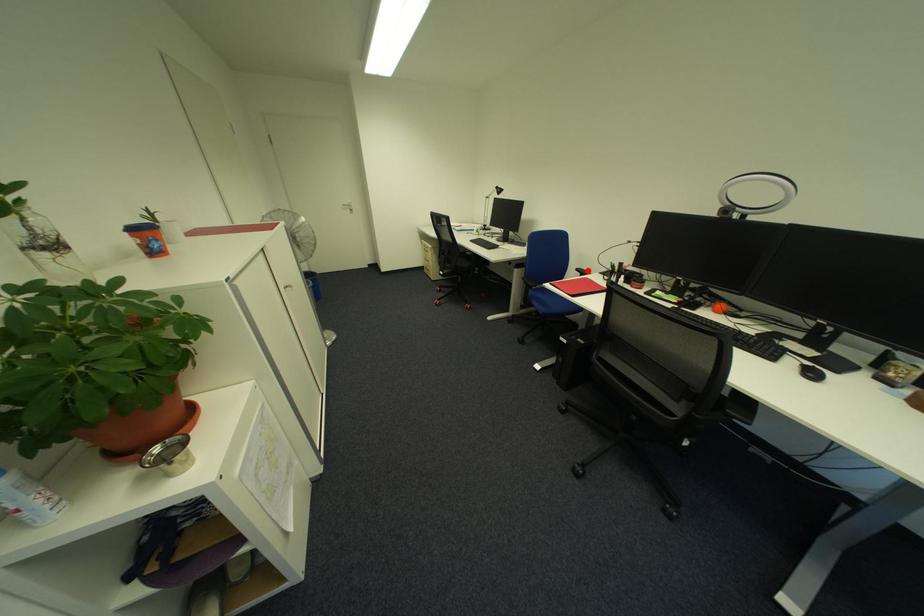
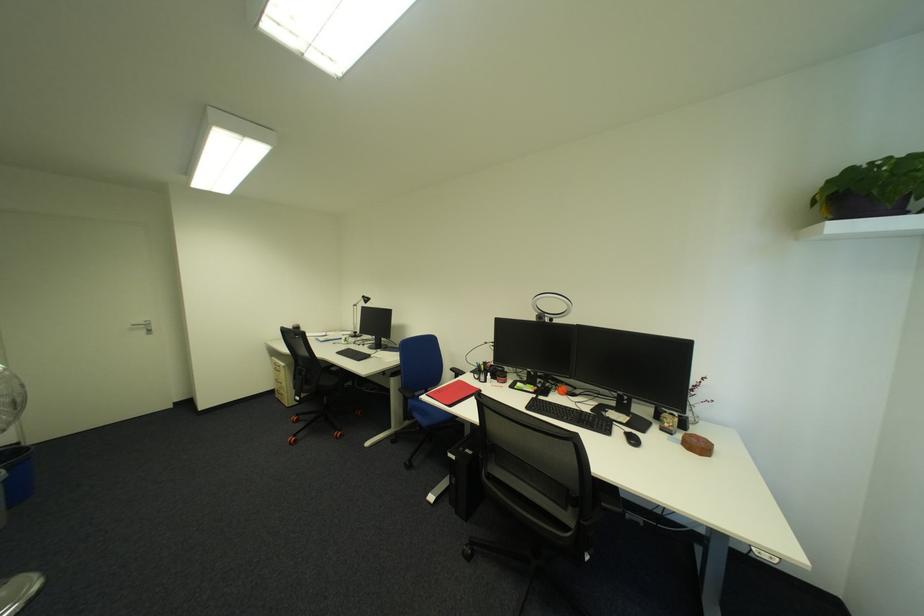
In the second image, find the point that corresponds to the highlighted location in the first image.

(462, 370)